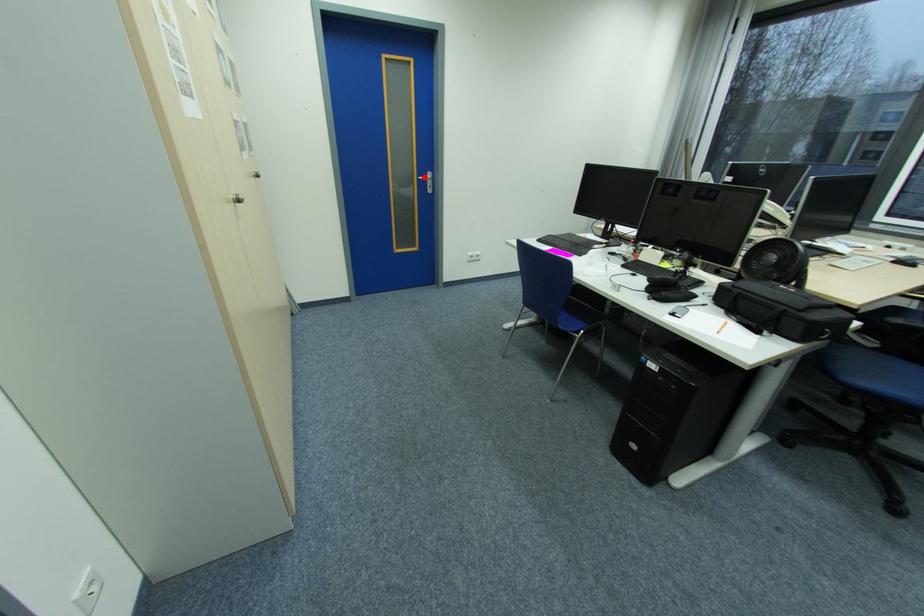
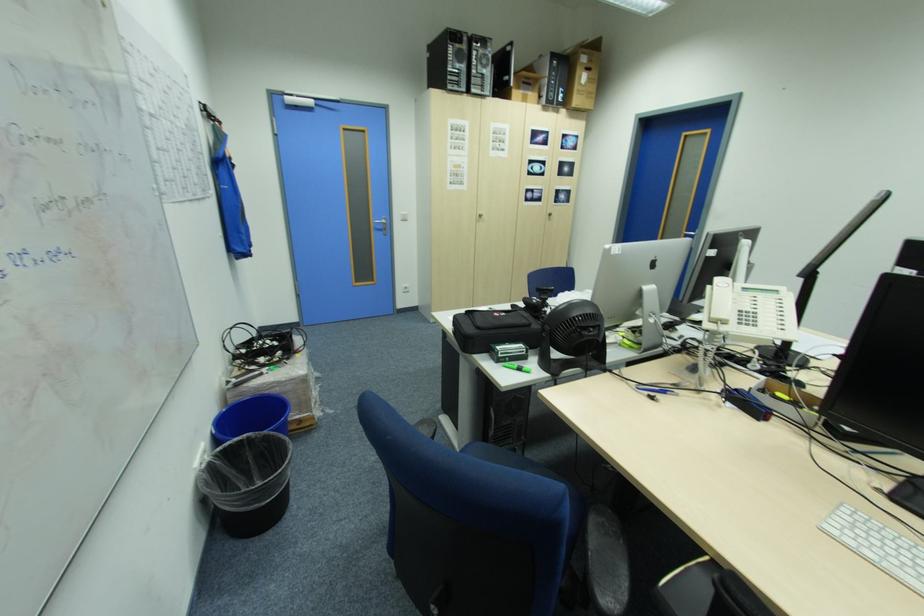
Question: I am providing you with two images of the same scene from different viewpoints. A red point is marked on the first image. At the location where the point appears in image 1, is it still visible in image 2?

Choices:
 (A) Yes
 (B) No

Answer: (B)